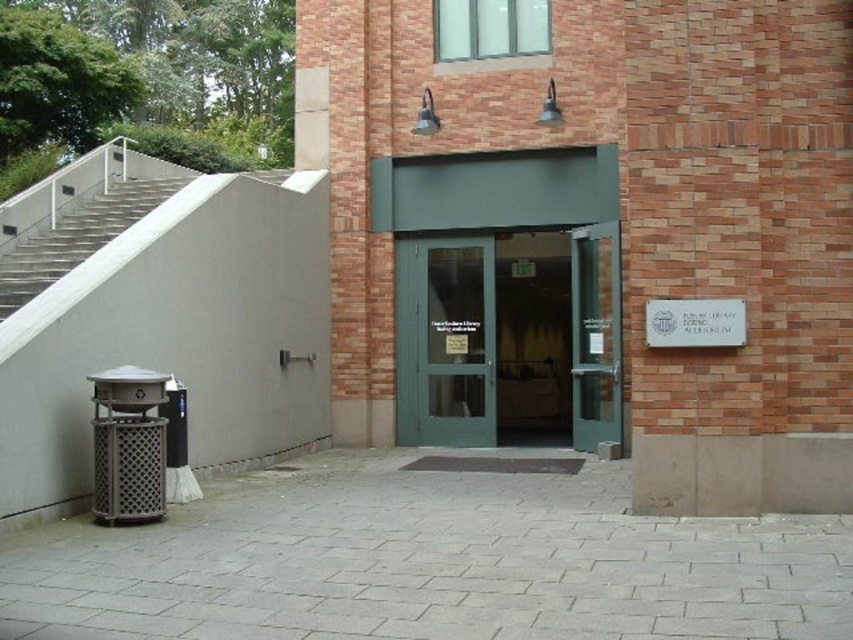
You are standing at the entrance of the building and want to determine which of the two points, point (x=498, y=348) or point (x=16, y=257), is closer to you. Based on the image, which point is nearer?

Point (x=498, y=348) is further to the viewer than point (x=16, y=257), so point (x=16, y=257) is closer to you.

You are a delivery person trying to enter the building. You see two doors at the entrance, a green glass door at center and a green matte door at center. Which door should you use to enter the building?

The green matte door at center is larger than the green glass door at center, so you should use the green matte door at center to enter the building since it is more likely to be the main entrance.